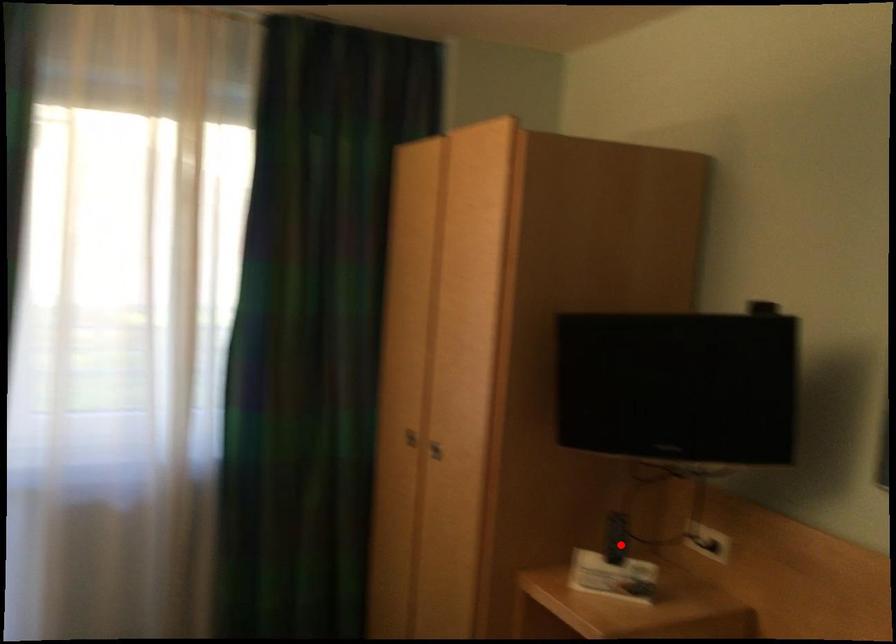
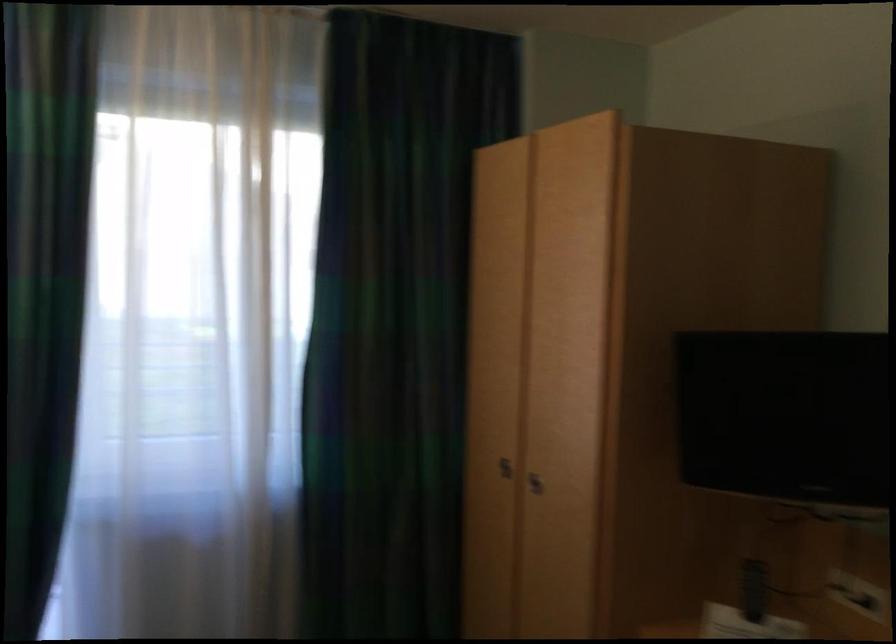
Question: A red point is marked in image1. In image2, is the corresponding 3D point closer to the camera or farther? Reply with the corresponding letter.

Choices:
 (A) The corresponding 3D point is closer.
 (B) The corresponding 3D point is farther.

Answer: (A)